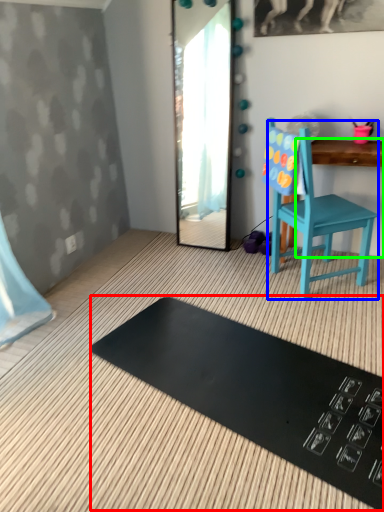
Question: Estimate the real-world distances between objects in this image. Which object is closer to mat (highlighted by a red box), chair (highlighted by a blue box) or changing table (highlighted by a green box)?

Choices:
 (A) chair
 (B) changing table

Answer: (A)